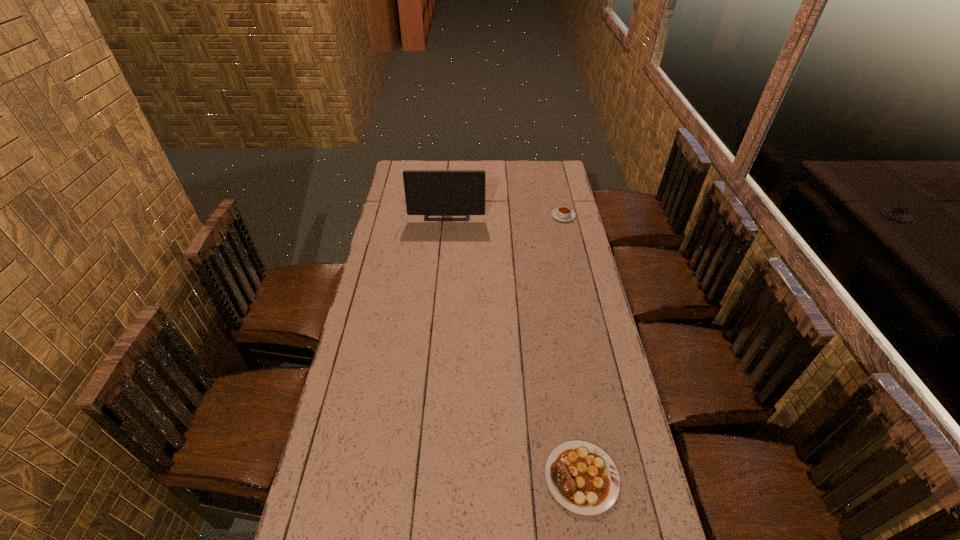
The width and height of the screenshot is (960, 540). I want to click on vacant region at the far edge, so click(494, 175).

You are a GUI agent. You are given a task and a screenshot of the screen. Output one action in this format:
    pyautogui.click(x=<x>, y=<y>)
    Task: Click on the free spot at the left edge of the desktop
    This screenshot has width=960, height=540.
    Given the screenshot: What is the action you would take?
    pyautogui.click(x=383, y=238)

In the image, there is a desktop. At what (x,y) coordinates should I click in order to perform the action: click on vacant space at the right edge. Please return your answer as a coordinate pair (x, y). Image resolution: width=960 pixels, height=540 pixels. Looking at the image, I should click on (614, 387).

This screenshot has width=960, height=540. Identify the location of free point at the far right corner. (554, 171).

Where is `vacant space that is in between the nearest object and the leftmost object`? vacant space that is in between the nearest object and the leftmost object is located at coordinates (515, 346).

Where is `unoccupied area between the pudding and the leftmost object`? The width and height of the screenshot is (960, 540). unoccupied area between the pudding and the leftmost object is located at coordinates (505, 214).

What are the coordinates of `free space that is in between the pudding and the leftmost object` in the screenshot? It's located at (505, 214).

Locate an element on the screen. free space between the pudding and the steak is located at coordinates (572, 347).

I want to click on free spot between the pudding and the steak, so click(572, 347).

The height and width of the screenshot is (540, 960). I want to click on empty space between the nearest object and the pudding, so click(x=572, y=347).